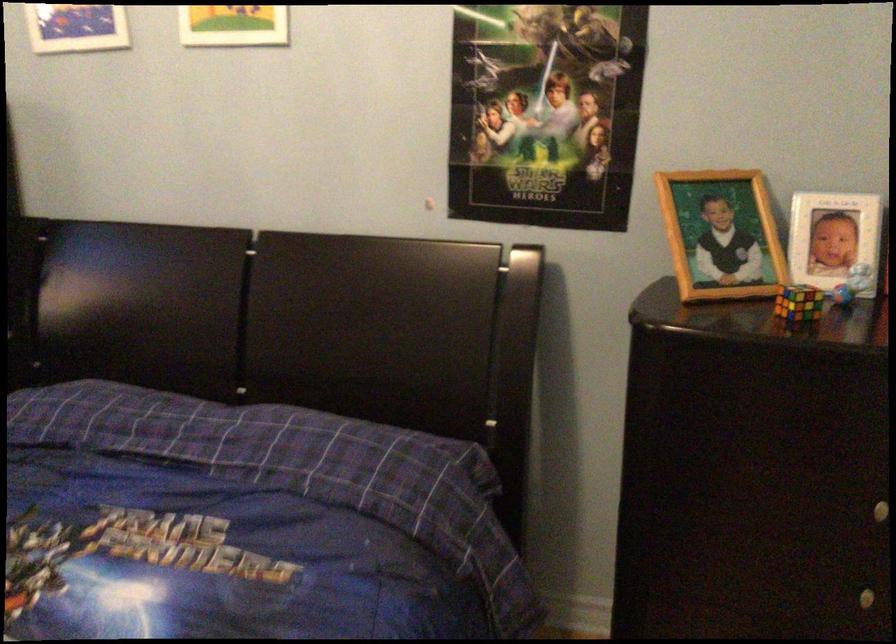
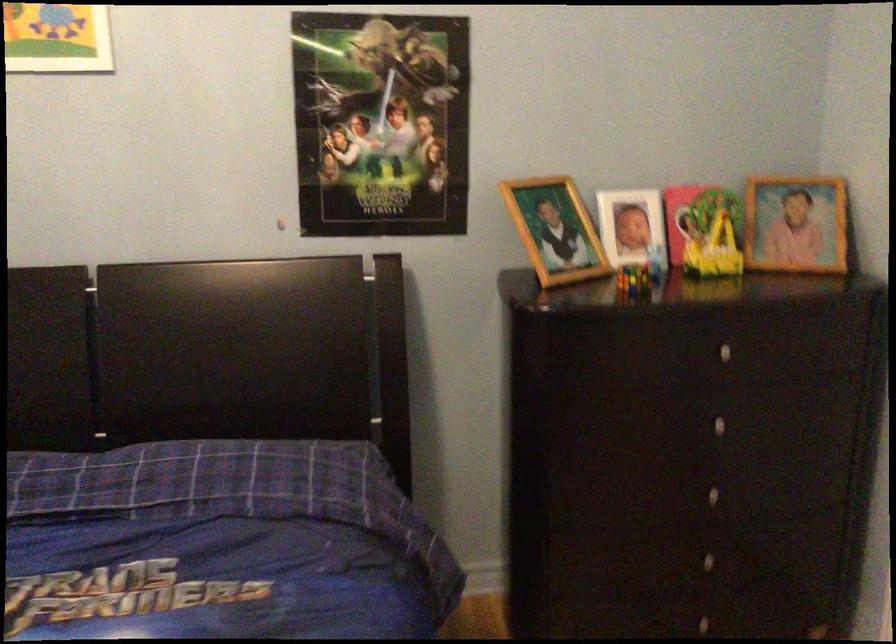
Question: Based on the continuous images, in which direction is the camera rotating? Reply with the corresponding letter.

Choices:
 (A) Left
 (B) Right
 (C) Up
 (D) Down

Answer: (B)